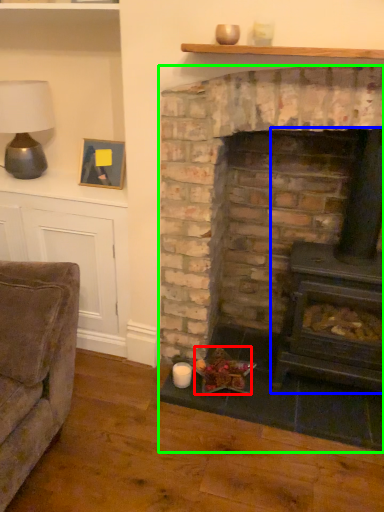
Question: Based on their relative distances, which object is farther from food (highlighted by a red box)? Choose from wood burning stove (highlighted by a blue box) and fireplace (highlighted by a green box).

Choices:
 (A) wood burning stove
 (B) fireplace

Answer: (A)